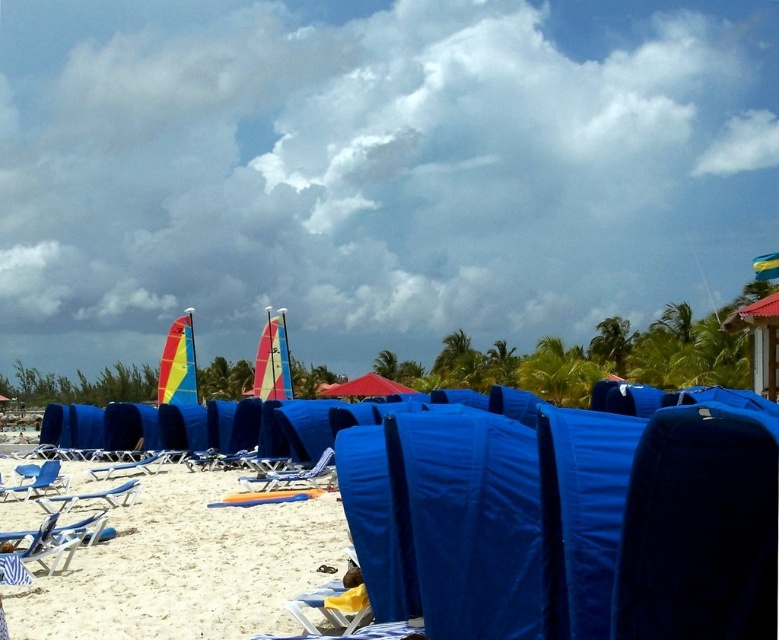
You are a lifeguard who needs to quickly reach both the red fabric umbrella at center and the metallic blue lounge chair at center during an emergency. Given that your maximum sprinting distance is 20 meters, can you reach both locations without exceeding your physical limit?

The distance between the red fabric umbrella at center and metallic blue lounge chair at center is 18.29 meters. Since your maximum sprinting distance is 20 meters, you can reach both locations without exceeding your physical limit because the total distance between them is within your capability.

You are standing on the white sandy beach at lower center and want to reach the red fabric umbrella at center. In which direction should you walk to get there?

You should walk to the right because the white sandy beach at lower center is positioned on the left side of the red fabric umbrella at center.

You are standing at the center of the beach scene. Which direction should you walk to reach the blue fabric chair at lower left?

You should walk towards the lower left direction to reach the blue fabric chair at lower left, as it is located at point (93, 497).